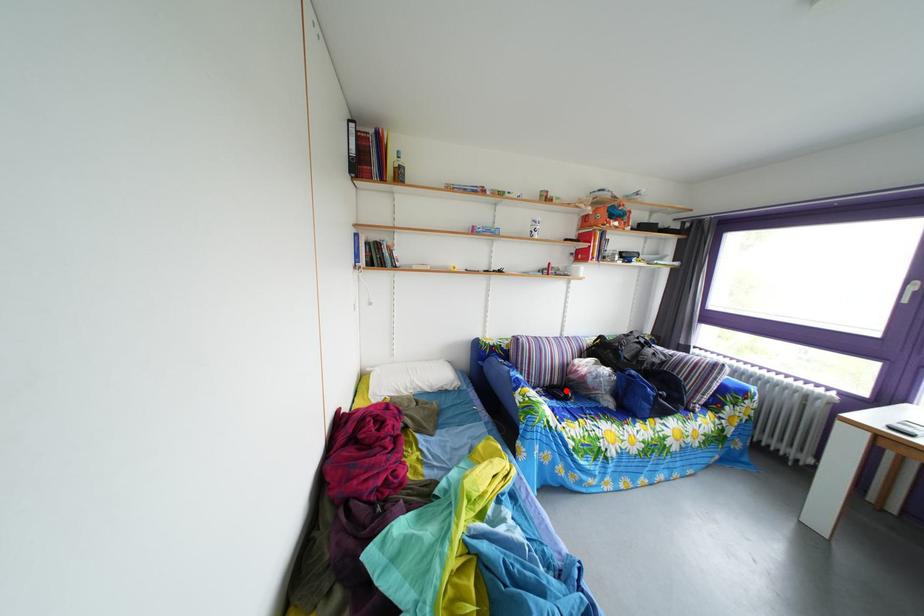
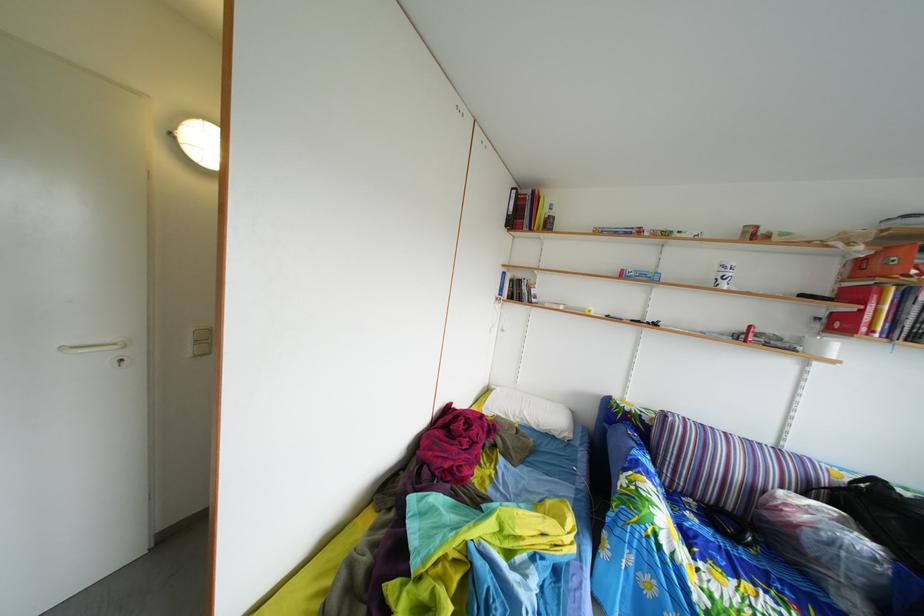
Locate, in the second image, the point that corresponds to the highlighted location in the first image.

(739, 516)